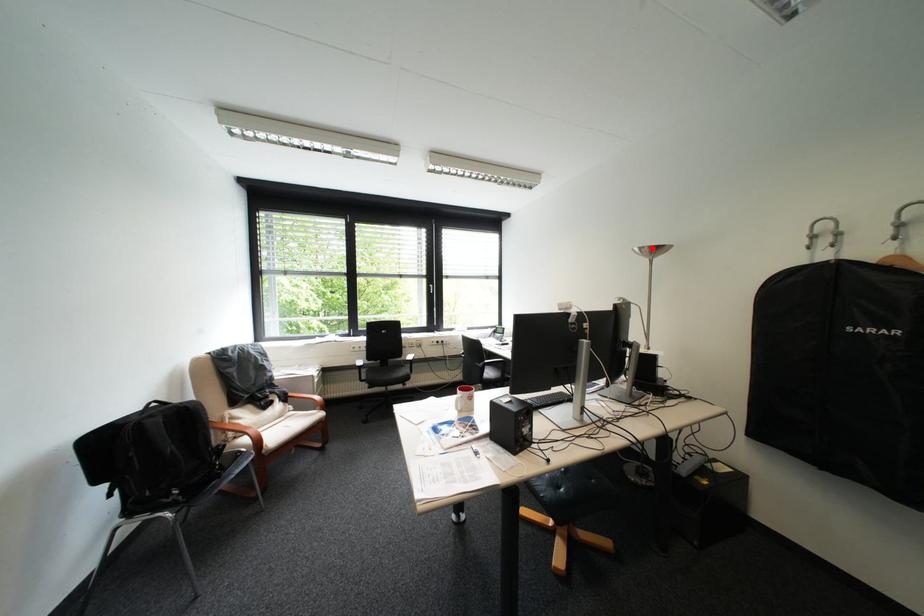
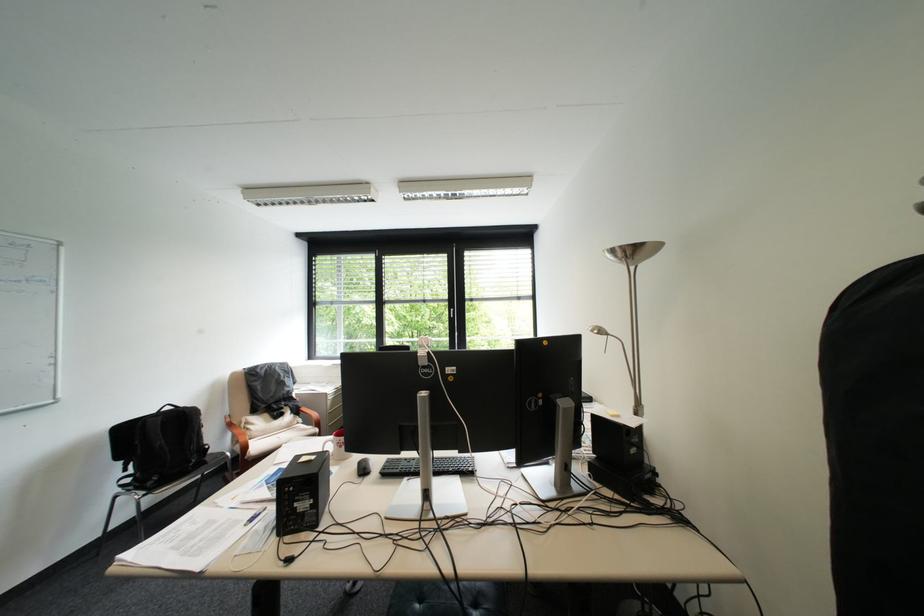
Find the pixel in the second image that matches the highlighted location in the first image.

(625, 252)